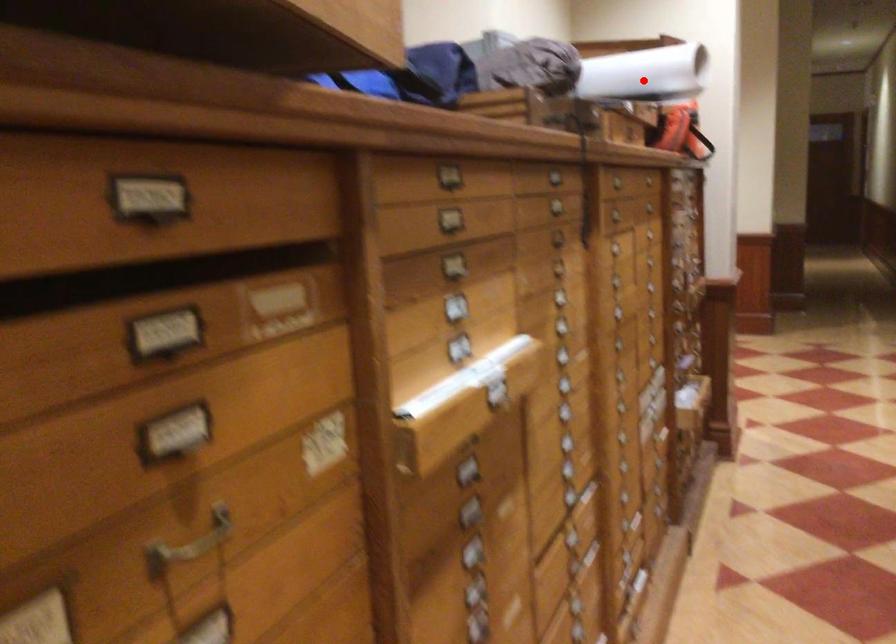
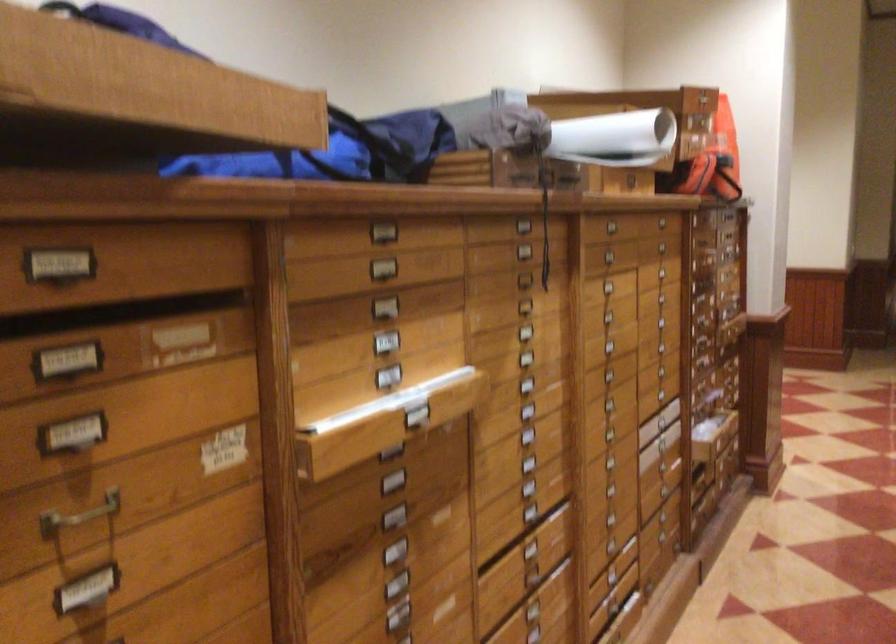
The point at the highlighted location is marked in the first image. Where is the corresponding point in the second image?

(615, 138)